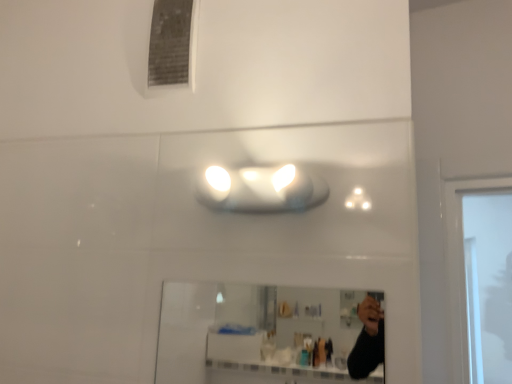
What do you see at coordinates (261, 189) in the screenshot? This screenshot has width=512, height=384. I see `white glossy light fixture at center` at bounding box center [261, 189].

The height and width of the screenshot is (384, 512). What are the coordinates of `white glossy light fixture at center` in the screenshot? It's located at (261, 189).

The height and width of the screenshot is (384, 512). Describe the element at coordinates (257, 334) in the screenshot. I see `clear glass mirror at center` at that location.

What is the approximate height of clear glass mirror at center?

It is 9.32 inches.

Measure the distance between clear glass mirror at center and camera.

The distance of clear glass mirror at center from camera is 8.13 feet.

Locate an element on the screen. clear glass mirror at center is located at coordinates (257, 334).

Locate an element on the screen. This screenshot has width=512, height=384. white glossy light fixture at center is located at coordinates (261, 189).

Looking at this image, in the image, is clear glass mirror at center on the left side or the right side of white glossy light fixture at center?

clear glass mirror at center is to the right of white glossy light fixture at center.

Which object is further away from the camera taking this photo, clear glass mirror at center or white glossy light fixture at center?

white glossy light fixture at center is further from the camera.

Which is in front, point (308, 299) or point (290, 188)?

Point (290, 188)

From the image's perspective, is clear glass mirror at center positioned above or below white glossy light fixture at center?

From the image's perspective, clear glass mirror at center appears below white glossy light fixture at center.

From a real-world perspective, is clear glass mirror at center beneath white glossy light fixture at center?

Yes.

Does clear glass mirror at center have a greater width compared to white glossy light fixture at center?

In fact, clear glass mirror at center might be narrower than white glossy light fixture at center.

Considering the sizes of objects clear glass mirror at center and white glossy light fixture at center in the image provided, who is taller, clear glass mirror at center or white glossy light fixture at center?

With more height is clear glass mirror at center.

Does clear glass mirror at center have a smaller size compared to white glossy light fixture at center?

Correct, clear glass mirror at center occupies less space than white glossy light fixture at center.

Would you say clear glass mirror at center is inside or outside white glossy light fixture at center?

clear glass mirror at center is spatially situated outside white glossy light fixture at center.

Would you consider clear glass mirror at center to be distant from white glossy light fixture at center?

Absolutely, clear glass mirror at center is distant from white glossy light fixture at center.

Could you tell me if clear glass mirror at center is turned towards white glossy light fixture at center?

No, clear glass mirror at center is not facing towards white glossy light fixture at center.

What's the angular difference between clear glass mirror at center and white glossy light fixture at center's facing directions?

The facing directions of clear glass mirror at center and white glossy light fixture at center are 0.00132 degrees apart.

Measure the distance between clear glass mirror at center and white glossy light fixture at center.

A distance of 7.80 feet exists between clear glass mirror at center and white glossy light fixture at center.

At what (x,y) coordinates should I click in order to perform the action: click on light fixture above the clear glass mirror at center (from the image's perspective). Please return your answer as a coordinate pair (x, y). Image resolution: width=512 pixels, height=384 pixels. Looking at the image, I should click on (261, 189).

Which is more to the right, white glossy light fixture at center or clear glass mirror at center?

From the viewer's perspective, clear glass mirror at center appears more on the right side.

Considering the positions of objects white glossy light fixture at center and clear glass mirror at center in the image provided, who is in front, white glossy light fixture at center or clear glass mirror at center?

clear glass mirror at center is in front.

Which is less distant, (234, 172) or (334, 295)?

Point (234, 172) appears to be closer to the viewer than point (334, 295).

In the scene shown: From the image's perspective, which one is positioned higher, white glossy light fixture at center or clear glass mirror at center?

white glossy light fixture at center.

From a real-world perspective, which is physically below, white glossy light fixture at center or clear glass mirror at center?

clear glass mirror at center.

Looking at their sizes, would you say white glossy light fixture at center is wider or thinner than clear glass mirror at center?

In the image, white glossy light fixture at center appears to be wider than clear glass mirror at center.

Which of these two, white glossy light fixture at center or clear glass mirror at center, stands shorter?

Standing shorter between the two is white glossy light fixture at center.

Which of these two, white glossy light fixture at center or clear glass mirror at center, is smaller?

With smaller size is clear glass mirror at center.

Is clear glass mirror at center completely or partially inside white glossy light fixture at center?

Actually, clear glass mirror at center is outside white glossy light fixture at center.

Is white glossy light fixture at center positioned far away from clear glass mirror at center?

Yes, white glossy light fixture at center and clear glass mirror at center are quite far apart.

Is white glossy light fixture at center facing away from clear glass mirror at center?

That's not correct — white glossy light fixture at center is not looking away from clear glass mirror at center.

At what (x,y) coordinates should I click in order to perform the action: click on mirror that is on the right side of white glossy light fixture at center. Please return your answer as a coordinate pair (x, y). Looking at the image, I should click on (257, 334).

Where is `mirror that is in front of the white glossy light fixture at center`? The image size is (512, 384). mirror that is in front of the white glossy light fixture at center is located at coordinates (257, 334).

Locate an element on the screen. This screenshot has width=512, height=384. light fixture above the clear glass mirror at center (from a real-world perspective) is located at coordinates (261, 189).